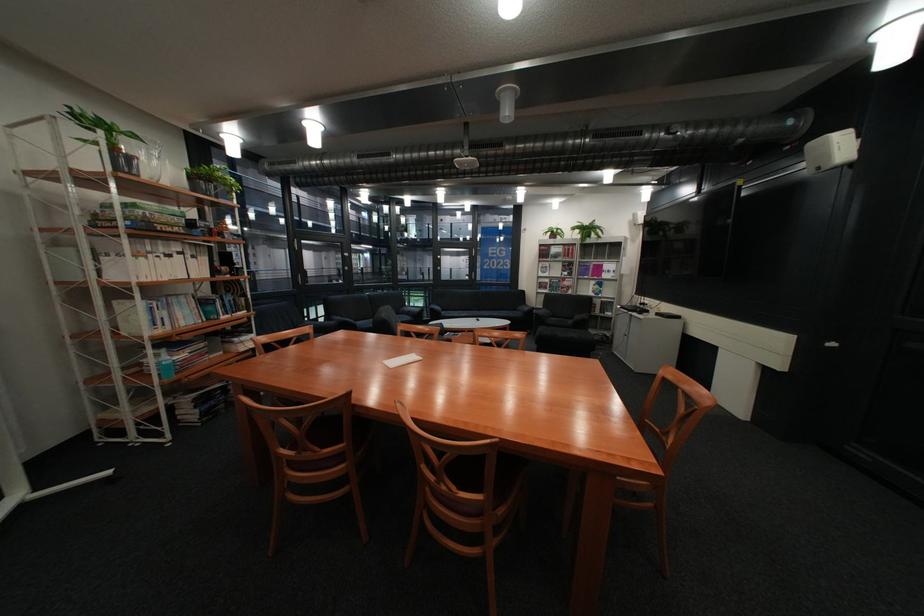
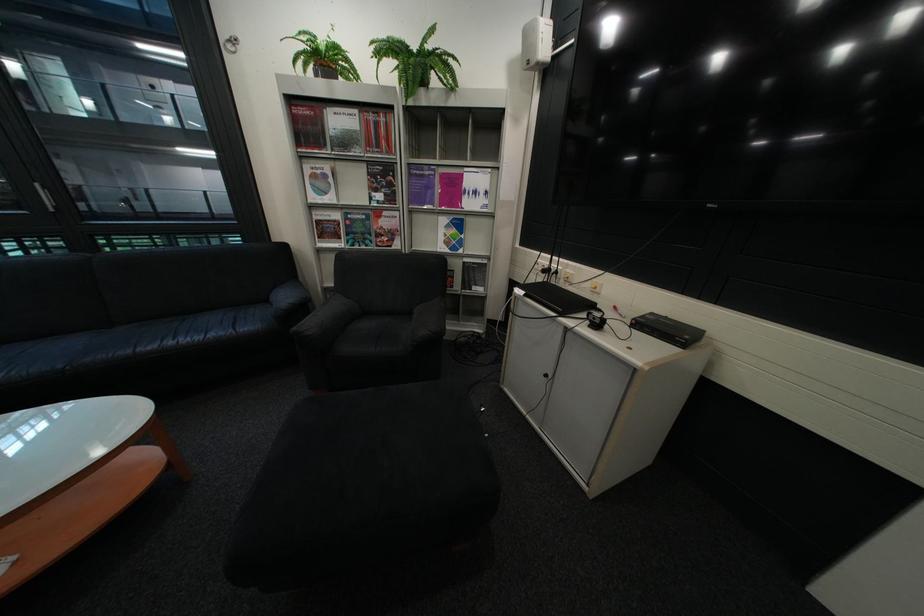
Locate, in the second image, the point that corresponds to (602,224) in the first image.

(430, 46)